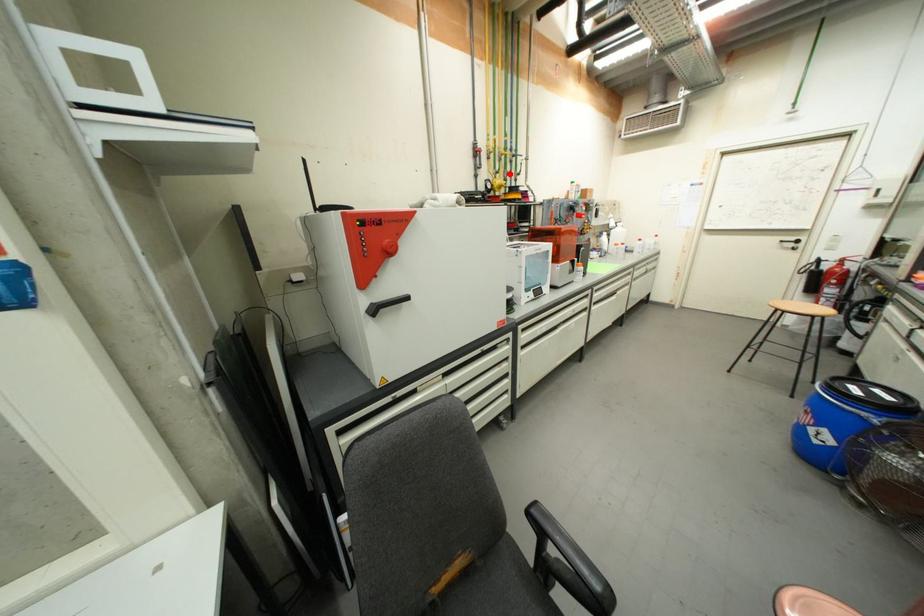
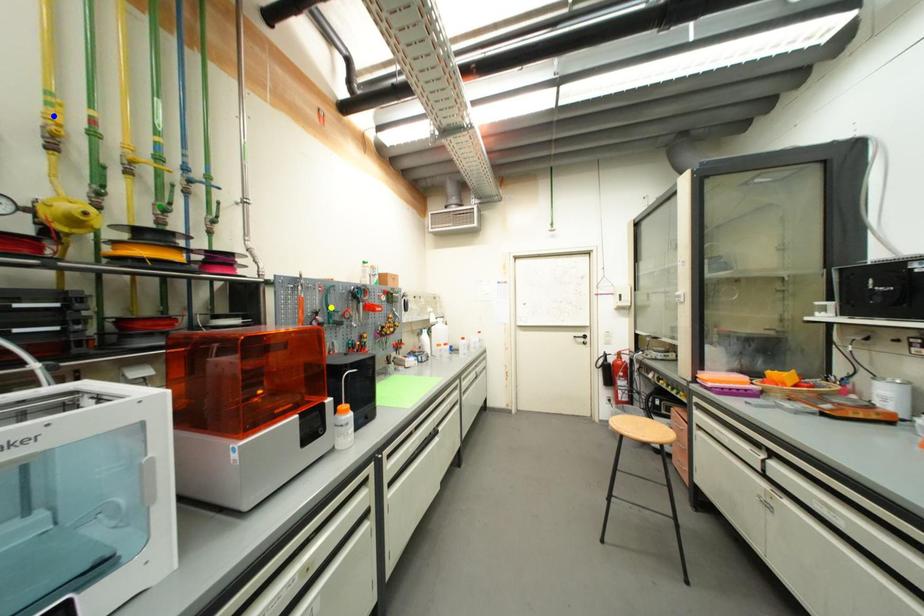
Question: I am providing you with two images of the same scene from different viewpoints. A red point is marked on the first image. You are given multiple points on the second image. Which mark in image 2 goes with the point in image 1?

Choices:
 (A) yellow point
 (B) blue point
 (C) green point

Answer: (C)